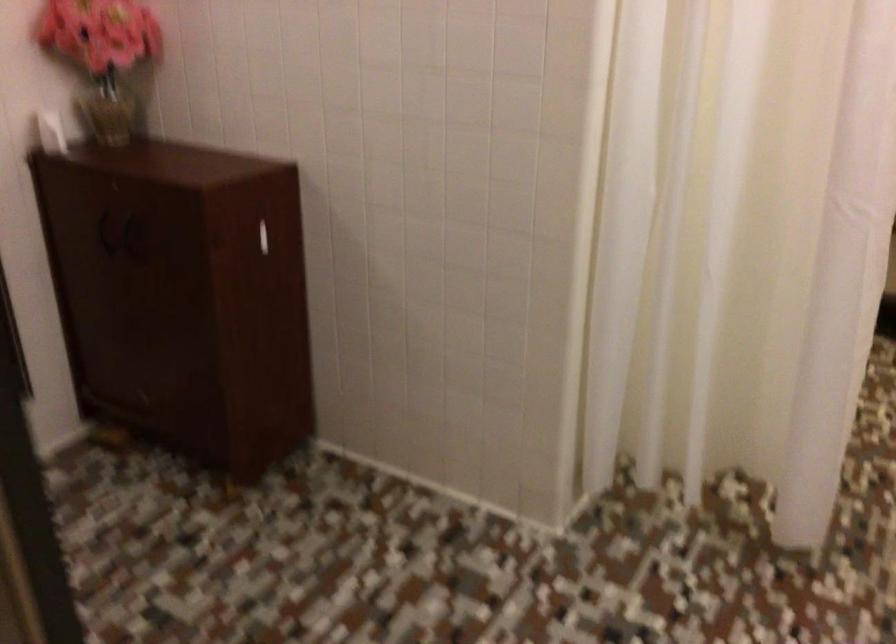
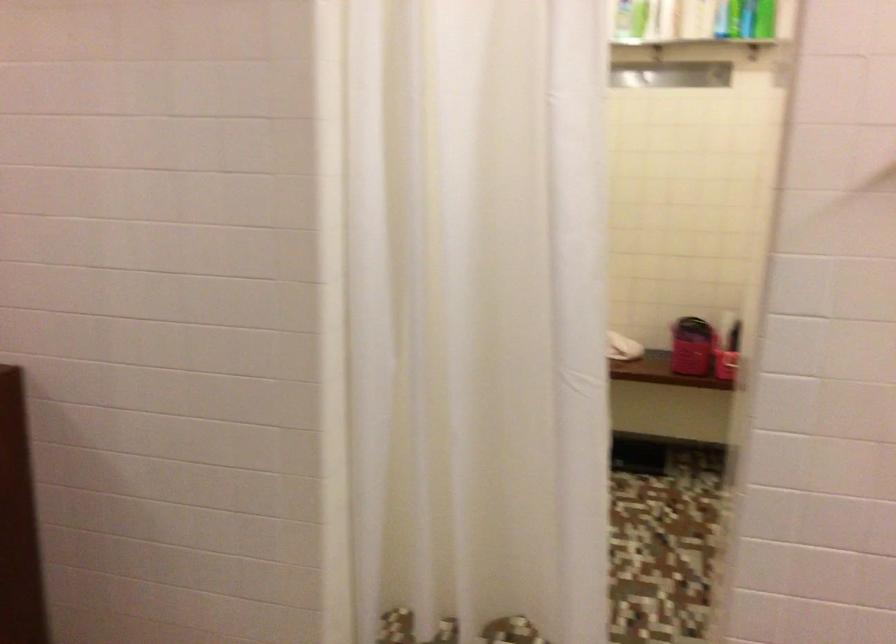
Question: The images are taken continuously from a first-person perspective. In which direction is your viewpoint rotating?

Choices:
 (A) Left
 (B) Right
 (C) Up
 (D) Down

Answer: (B)